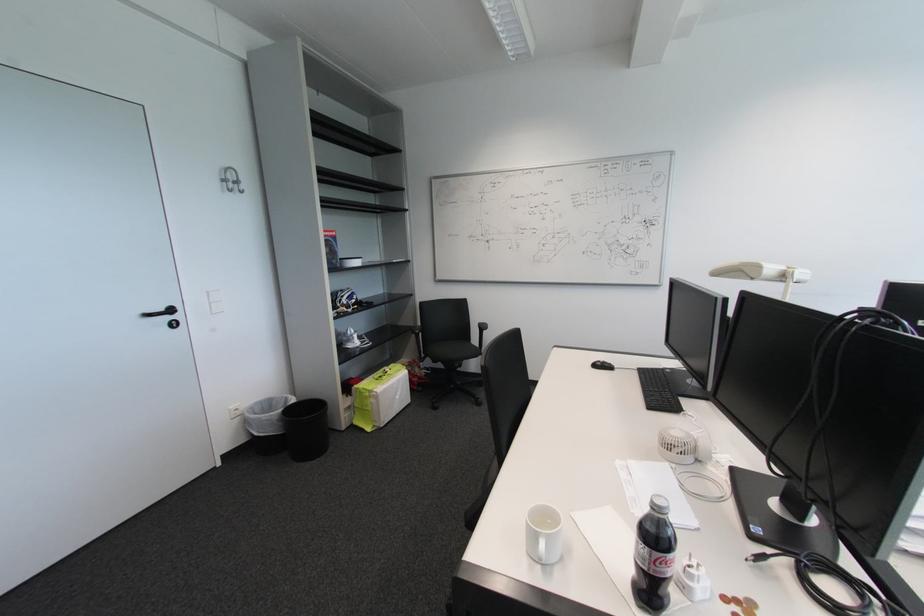
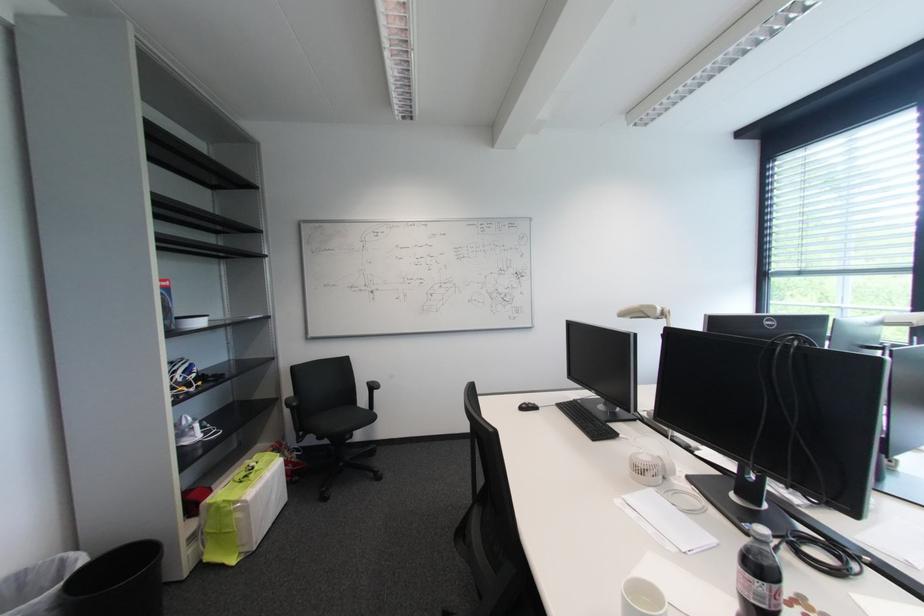
Where in the second image is the point corresponding to (684,452) from the first image?

(657, 475)